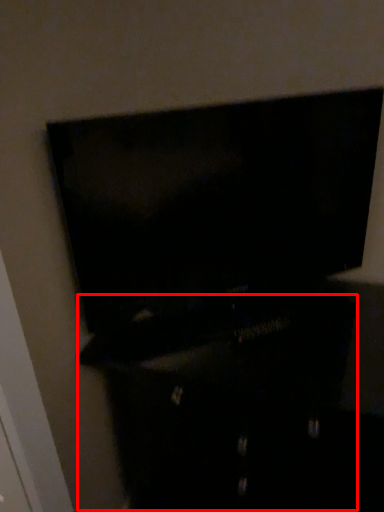
Question: Observing the image, what is the correct spatial positioning of dresser (annotated by the red box) in reference to furniture?

Choices:
 (A) left
 (B) right

Answer: (B)